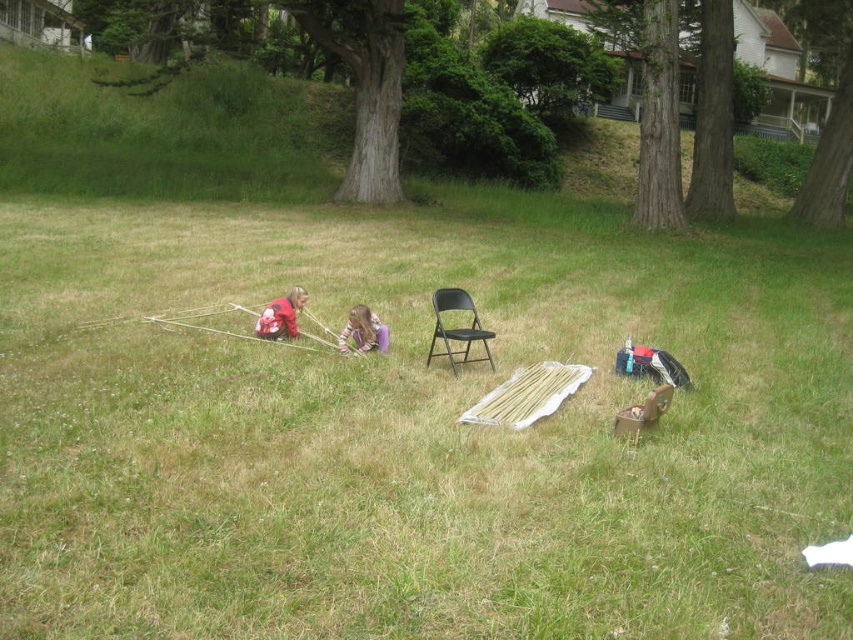
Question: Does green grassy at center come in front of red matte jacket at center?

Choices:
 (A) yes
 (B) no

Answer: (A)

Question: Is the position of wooden chair at lower right more distant than that of purple fabric at center?

Choices:
 (A) no
 (B) yes

Answer: (A)

Question: Which point appears closest to the camera in this image?

Choices:
 (A) (592, 472)
 (B) (366, 333)
 (C) (277, 301)
 (D) (431, 355)

Answer: (A)

Question: Which object is positioned closest to the black plastic chair at center?

Choices:
 (A) wooden chair at lower right
 (B) red matte jacket at center
 (C) green grassy at center

Answer: (B)

Question: Is black plastic chair at center behind red matte jacket at center?

Choices:
 (A) yes
 (B) no

Answer: (B)

Question: Which of the following is the closest to the observer?

Choices:
 (A) black plastic chair at center
 (B) purple fabric at center

Answer: (A)